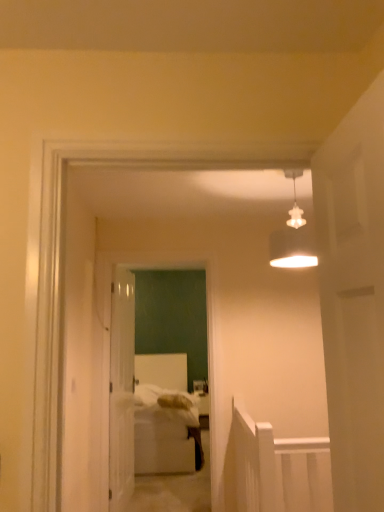
Question: From the image's perspective, is white glossy door at center under white matte lampshade at upper center?

Choices:
 (A) yes
 (B) no

Answer: (A)

Question: Is white glossy door at center shorter than white matte lampshade at upper center?

Choices:
 (A) no
 (B) yes

Answer: (A)

Question: Does white glossy door at center have a greater height compared to white matte lampshade at upper center?

Choices:
 (A) yes
 (B) no

Answer: (A)

Question: From a real-world perspective, is white glossy door at center physically above white matte lampshade at upper center?

Choices:
 (A) no
 (B) yes

Answer: (A)

Question: Considering the relative sizes of white glossy door at center and white matte lampshade at upper center in the image provided, is white glossy door at center wider than white matte lampshade at upper center?

Choices:
 (A) yes
 (B) no

Answer: (B)

Question: Is point (276, 244) closer or farther from the camera than point (180, 355)?

Choices:
 (A) closer
 (B) farther

Answer: (A)

Question: Is white matte lampshade at upper center inside the boundaries of white soft bed at center, or outside?

Choices:
 (A) outside
 (B) inside

Answer: (A)

Question: Visually, is white matte lampshade at upper center positioned to the left or to the right of white soft bed at center?

Choices:
 (A) right
 (B) left

Answer: (A)

Question: From a real-world perspective, relative to white soft bed at center, is white matte lampshade at upper center vertically above or below?

Choices:
 (A) above
 (B) below

Answer: (A)

Question: Is white matte door at right, positioned as the 1th door in front-to-back order, to the left or to the right of white glossy door at center, marked as the 2th door in a right-to-left arrangement, in the image?

Choices:
 (A) left
 (B) right

Answer: (B)

Question: Based on their sizes in the image, would you say white matte door at right, acting as the second door starting from the left, is bigger or smaller than white glossy door at center, placed as the 1th door when sorted from left to right?

Choices:
 (A) small
 (B) big

Answer: (A)

Question: Is point (324, 324) positioned closer to the camera than point (125, 495)?

Choices:
 (A) closer
 (B) farther

Answer: (A)

Question: In terms of width, does white matte door at right, positioned as the 1th door in front-to-back order, look wider or thinner when compared to white glossy door at center, placed as the 1th door when sorted from left to right?

Choices:
 (A) thin
 (B) wide

Answer: (A)

Question: From a real-world perspective, is white glossy door at center, which is the first door in back-to-front order, above or below white glossy door at center?

Choices:
 (A) above
 (B) below

Answer: (B)

Question: Is white glossy door at center, marked as the 2th door in a right-to-left arrangement, inside or outside of white glossy door at center?

Choices:
 (A) outside
 (B) inside

Answer: (A)